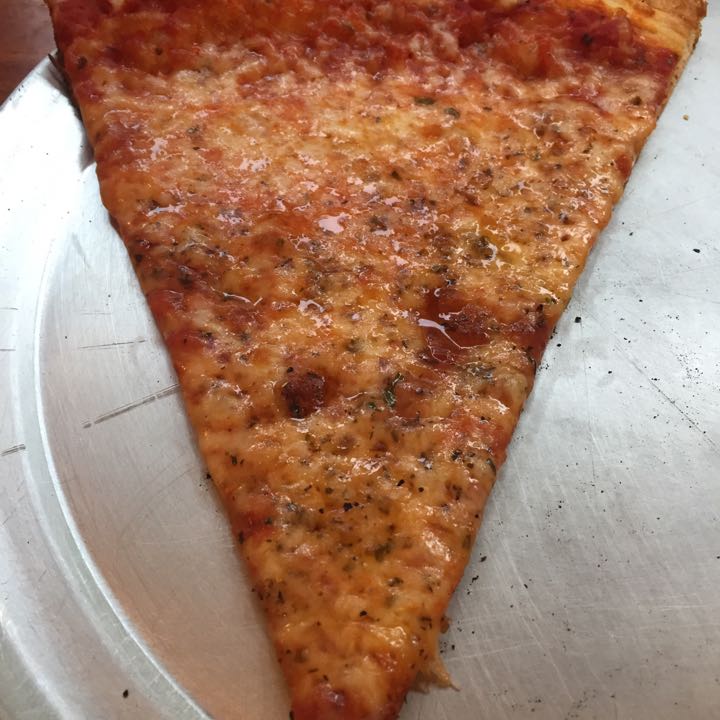
Where is `plate`? The width and height of the screenshot is (720, 720). plate is located at coordinates (574, 566).